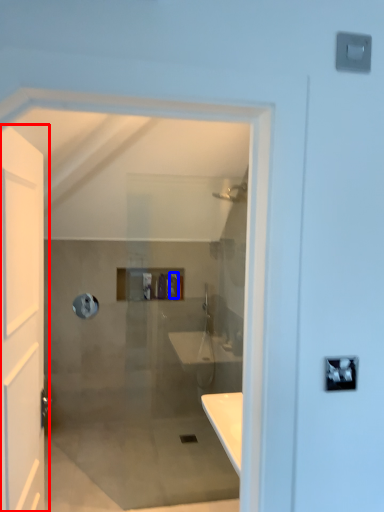
Question: Which point is closer to the camera, door (highlighted by a red box) or toiletry (highlighted by a blue box)?

Choices:
 (A) door
 (B) toiletry

Answer: (A)